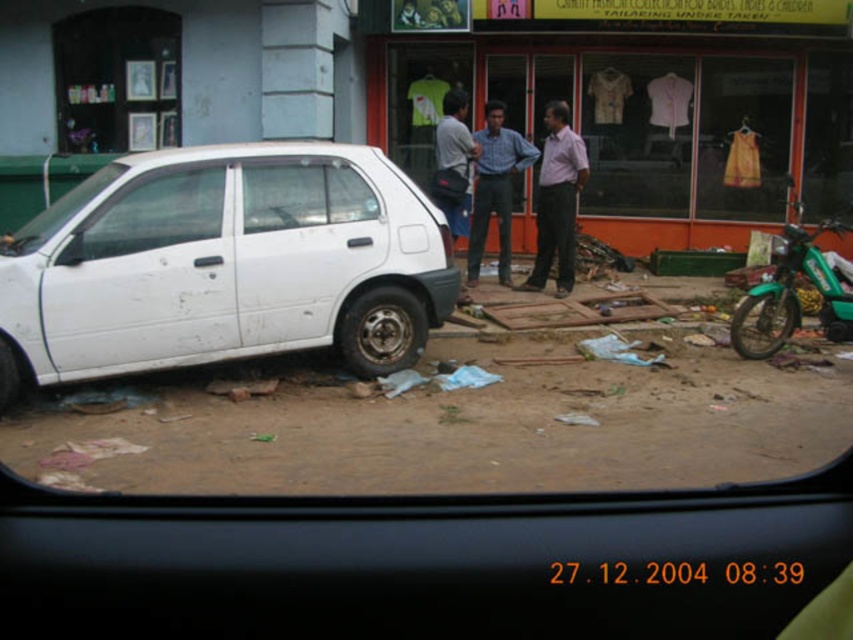
Question: Is transparent glass window at left wider than green matte motorcycle at right?

Choices:
 (A) yes
 (B) no

Answer: (B)

Question: Can you confirm if transparent glass window at left is wider than pink smooth shirt at center?

Choices:
 (A) yes
 (B) no

Answer: (A)

Question: Which object is farther from the camera taking this photo?

Choices:
 (A) transparent glass window at left
 (B) light blue shirt at center
 (C) blue shirt at center
 (D) green matte motorcycle at right

Answer: (C)

Question: Which point is farther to the camera?

Choices:
 (A) green matte motorcycle at right
 (B) transparent glass window at center

Answer: (A)

Question: Is white matte car at left below transparent glass window at left?

Choices:
 (A) no
 (B) yes

Answer: (B)

Question: Which of these objects is positioned closest to the light blue shirt at center?

Choices:
 (A) green matte motorcycle at right
 (B) blue shirt at center

Answer: (B)